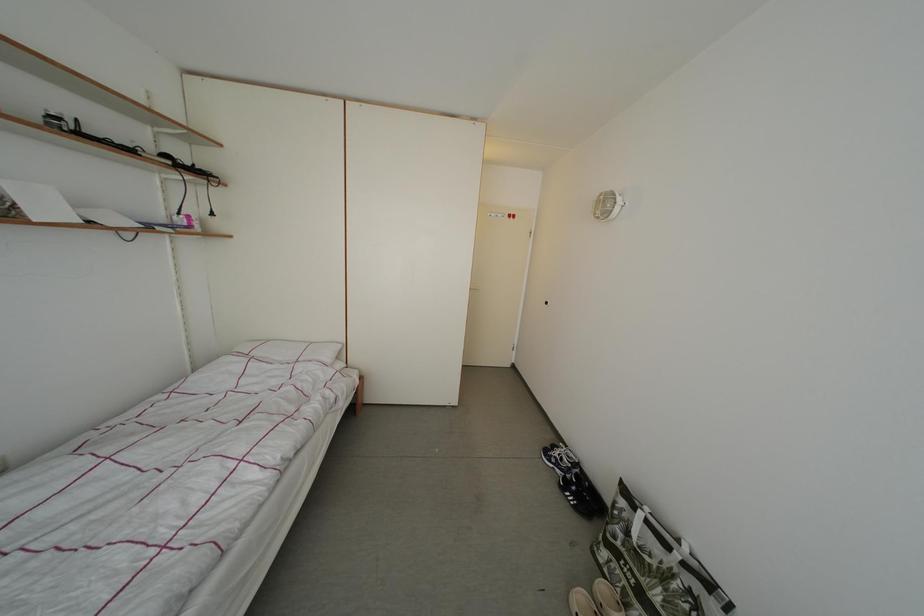
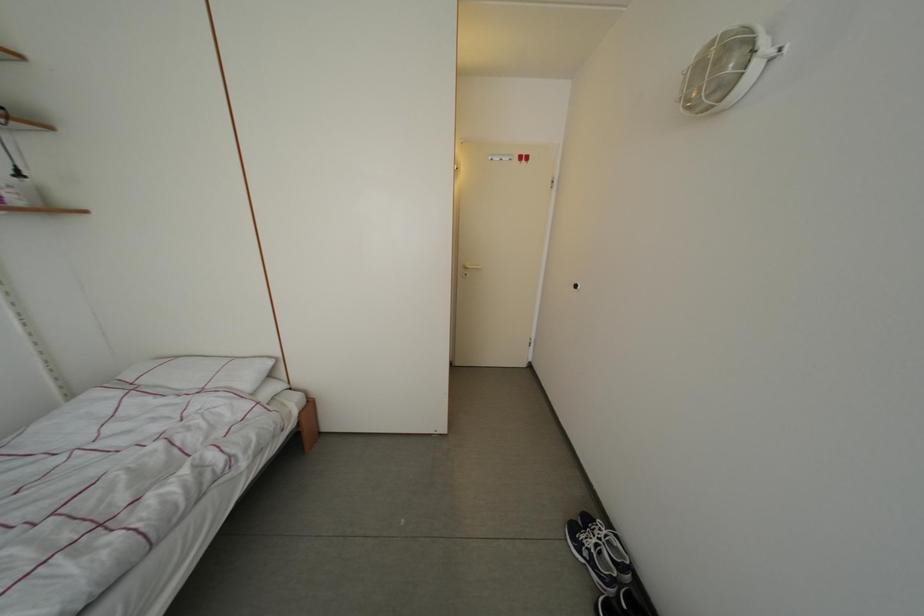
Question: Based on the continuous images, in which direction is the camera rotating? Reply with the corresponding letter.

Choices:
 (A) Left
 (B) Right
 (C) Up
 (D) Down

Answer: (A)